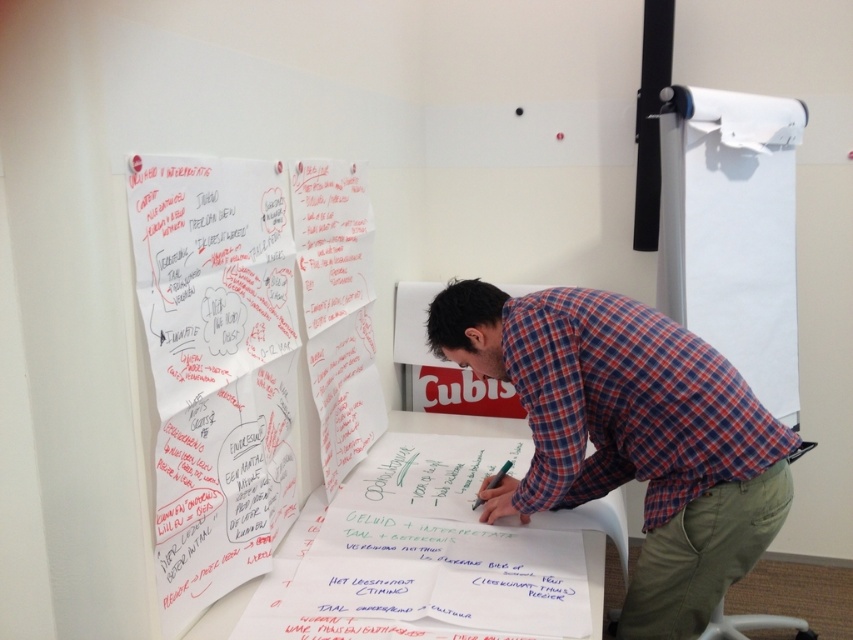
Question: Which object appears closest to the camera in this image?

Choices:
 (A) white paper at center
 (B) white paper at upper left

Answer: (B)

Question: Which is nearer to the white paper at upper left?

Choices:
 (A) plaid shirt at center
 (B) green matte pen at center

Answer: (A)

Question: Can you confirm if plaid shirt at center is smaller than green matte pen at center?

Choices:
 (A) no
 (B) yes

Answer: (A)

Question: Does white paper at center have a smaller size compared to green matte pen at center?

Choices:
 (A) yes
 (B) no

Answer: (B)

Question: Among these objects, which one is farthest from the camera?

Choices:
 (A) white paper at center
 (B) green matte pen at center
 (C) plaid shirt at center

Answer: (A)

Question: Is white paper at center positioned at the back of green matte pen at center?

Choices:
 (A) no
 (B) yes

Answer: (B)